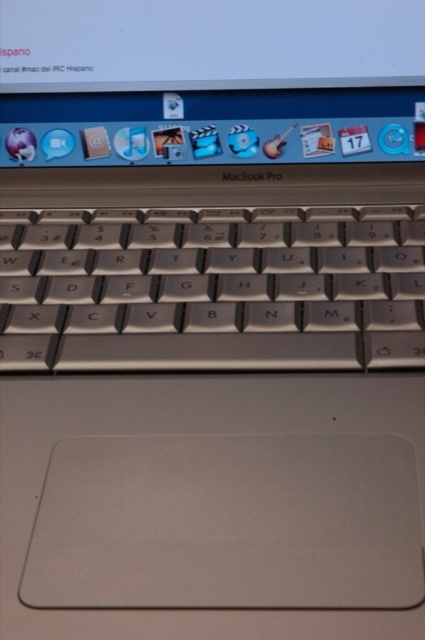
Question: Is satin silver keyboard at center positioned before white glossy screen at upper center?

Choices:
 (A) yes
 (B) no

Answer: (A)

Question: Does satin silver keyboard at center lie behind white glossy screen at upper center?

Choices:
 (A) yes
 (B) no

Answer: (B)

Question: Does satin silver keyboard at center appear on the left side of white glossy screen at upper center?

Choices:
 (A) no
 (B) yes

Answer: (B)

Question: Which object is closer to the camera taking this photo?

Choices:
 (A) white glossy screen at upper center
 (B) satin silver keyboard at center

Answer: (B)